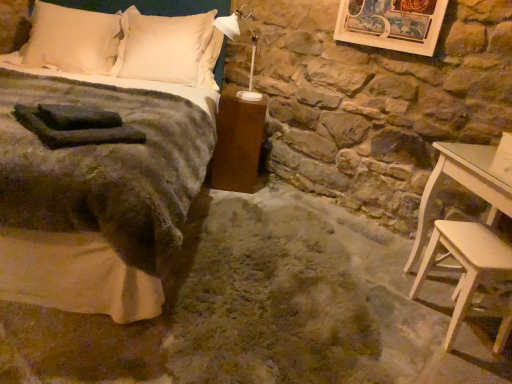
The image size is (512, 384). I want to click on light beige wood stool at lower right, so click(x=466, y=264).

Describe the element at coordinates (169, 48) in the screenshot. I see `satin white pillow at upper center, the first pillow from the right` at that location.

You are a GUI agent. You are given a task and a screenshot of the screen. Output one action in this format:
    pyautogui.click(x=<x>, y=<y>)
    Task: Click on the satin white pillow at upper center, the first pillow from the right
    
    Given the screenshot: What is the action you would take?
    pyautogui.click(x=169, y=48)

This screenshot has width=512, height=384. Find the location of `white soft pillow at upper left, arranged as the 2th pillow when viewed from the right`. white soft pillow at upper left, arranged as the 2th pillow when viewed from the right is located at coordinates (71, 40).

This screenshot has height=384, width=512. Find the location of `velvet green blanket at left`. velvet green blanket at left is located at coordinates (106, 158).

Locate an element on the screen. The width and height of the screenshot is (512, 384). pillow that is the 2nd object located behind the velvet green blanket at left is located at coordinates (169, 48).

From a real-world perspective, which is physically above, satin white pillow at upper center, the first pillow from the right, or velvet green blanket at left?

In real-world perspective, satin white pillow at upper center, the first pillow from the right, is above.

Which object is closer to the camera taking this photo, satin white pillow at upper center, the first pillow from the right, or velvet green blanket at left?

velvet green blanket at left is in front.

From the image's perspective, is satin white pillow at upper center, the first pillow from the right, above or below velvet green blanket at left?

Based on their image positions, satin white pillow at upper center, the first pillow from the right, is located above velvet green blanket at left.

Based on the photo, is satin white pillow at upper center, the 2th pillow in the left-to-right sequence, completely or partially inside velvet green blanket at left?

That's correct, satin white pillow at upper center, the 2th pillow in the left-to-right sequence, is inside velvet green blanket at left.

From a real-world perspective, is velvet green blanket at left located beneath satin white pillow at upper center, the first pillow from the right?

Correct, in the physical world, velvet green blanket at left is lower than satin white pillow at upper center, the first pillow from the right.

Which of these two, velvet green blanket at left or satin white pillow at upper center, the 2th pillow in the left-to-right sequence, is thinner?

satin white pillow at upper center, the 2th pillow in the left-to-right sequence.

From the picture: Is velvet green blanket at left positioned far away from satin white pillow at upper center, the first pillow from the right?

No, velvet green blanket at left is in close proximity to satin white pillow at upper center, the first pillow from the right.

Is the surface of white soft pillow at upper left, arranged as the 2th pillow when viewed from the right, in direct contact with satin white pillow at upper center, the first pillow from the right?

No, white soft pillow at upper left, arranged as the 2th pillow when viewed from the right, is not in contact with satin white pillow at upper center, the first pillow from the right.

Which is closer to the camera, (114, 24) or (189, 33)?

Point (114, 24) is positioned farther from the camera compared to point (189, 33).

Does white soft pillow at upper left, which is counted as the 1th pillow, starting from the left, have a larger size compared to satin white pillow at upper center, the 2th pillow in the left-to-right sequence?

No, white soft pillow at upper left, which is counted as the 1th pillow, starting from the left, is not bigger than satin white pillow at upper center, the 2th pillow in the left-to-right sequence.

Considering the relative positions of white soft pillow at upper left, arranged as the 2th pillow when viewed from the right, and satin white pillow at upper center, the 2th pillow in the left-to-right sequence, in the image provided, is white soft pillow at upper left, arranged as the 2th pillow when viewed from the right, to the left of satin white pillow at upper center, the 2th pillow in the left-to-right sequence, from the viewer's perspective?

Yes.

Which is correct: satin white pillow at upper center, the 2th pillow in the left-to-right sequence, is inside light beige wood stool at lower right, or outside of it?

satin white pillow at upper center, the 2th pillow in the left-to-right sequence, is spatially situated outside light beige wood stool at lower right.

Which of these two, satin white pillow at upper center, the 2th pillow in the left-to-right sequence, or light beige wood stool at lower right, stands taller?

satin white pillow at upper center, the 2th pillow in the left-to-right sequence.

Is satin white pillow at upper center, the 2th pillow in the left-to-right sequence, directly adjacent to light beige wood stool at lower right?

No.

Consider the image. Is satin white pillow at upper center, the first pillow from the right, in front of or behind light beige wood stool at lower right in the image?

Visually, satin white pillow at upper center, the first pillow from the right, is located behind light beige wood stool at lower right.

Between point (476, 247) and point (210, 93), which one is positioned in front?

The point (476, 247) is closer to the camera.

How different are the orientations of light beige wood stool at lower right and velvet green blanket at left in degrees?

77.7 degrees separate the facing orientations of light beige wood stool at lower right and velvet green blanket at left.

Identify the location of stool beneath the velvet green blanket at left (from a real-world perspective). This screenshot has height=384, width=512. (466, 264).

Considering the sizes of objects light beige wood stool at lower right and velvet green blanket at left in the image provided, who is wider, light beige wood stool at lower right or velvet green blanket at left?

Wider between the two is velvet green blanket at left.

Is light beige wood stool at lower right next to satin white pillow at upper center, the 2th pillow in the left-to-right sequence, and touching it?

light beige wood stool at lower right is not next to satin white pillow at upper center, the 2th pillow in the left-to-right sequence, and they're not touching.

Where is `stool located below the satin white pillow at upper center, the first pillow from the right (from the image's perspective)`? The height and width of the screenshot is (384, 512). stool located below the satin white pillow at upper center, the first pillow from the right (from the image's perspective) is located at coordinates tap(466, 264).

How many degrees apart are the facing directions of light beige wood stool at lower right and satin white pillow at upper center, the first pillow from the right?

80.2 degrees.

Based on their sizes in the image, would you say brown matte nightstand at lower center is bigger or smaller than velvet green blanket at left?

In the image, brown matte nightstand at lower center appears to be smaller than velvet green blanket at left.

From the image's perspective, would you say brown matte nightstand at lower center is positioned over velvet green blanket at left?

No, from the image's perspective, brown matte nightstand at lower center is not over velvet green blanket at left.

Does point (242, 122) come closer to viewer compared to point (193, 196)?

No, (242, 122) is behind (193, 196).

Considering the relative sizes of brown matte nightstand at lower center and velvet green blanket at left in the image provided, is brown matte nightstand at lower center thinner than velvet green blanket at left?

Correct, the width of brown matte nightstand at lower center is less than that of velvet green blanket at left.

Locate an element on the screen. The height and width of the screenshot is (384, 512). pillow on the right of velvet green blanket at left is located at coordinates (169, 48).

Find the location of a particular element. The height and width of the screenshot is (384, 512). bed directly beneath the satin white pillow at upper center, the 2th pillow in the left-to-right sequence (from a real-world perspective) is located at coordinates (106, 158).

When comparing their distances from light beige wood stool at lower right, does satin white pillow at upper center, the 2th pillow in the left-to-right sequence, or white soft pillow at upper left, arranged as the 2th pillow when viewed from the right, seem closer?

Based on the image, satin white pillow at upper center, the 2th pillow in the left-to-right sequence, appears to be nearer to light beige wood stool at lower right.

When comparing their distances from satin white pillow at upper center, the first pillow from the right, does brown matte nightstand at lower center or white soft pillow at upper left, which is counted as the 1th pillow, starting from the left, seem further?

Among the two, brown matte nightstand at lower center is located further to satin white pillow at upper center, the first pillow from the right.

Based on their spatial positions, is velvet green blanket at left or light beige wood stool at lower right closer to satin white pillow at upper center, the first pillow from the right?

velvet green blanket at left.

From the image, which object appears to be nearer to light beige wood stool at lower right, brown matte nightstand at lower center or white soft pillow at upper left, which is counted as the 1th pillow, starting from the left?

brown matte nightstand at lower center is closer to light beige wood stool at lower right.

Based on the photo, from the image, which object appears to be nearer to satin white pillow at upper center, the 2th pillow in the left-to-right sequence, velvet green blanket at left or brown matte nightstand at lower center?

velvet green blanket at left.

Estimate the real-world distances between objects in this image. Which object is closer to brown matte nightstand at lower center, light beige wood stool at lower right or white soft pillow at upper left, arranged as the 2th pillow when viewed from the right?

white soft pillow at upper left, arranged as the 2th pillow when viewed from the right, is closer to brown matte nightstand at lower center.

Based on their spatial positions, is velvet green blanket at left or brown matte nightstand at lower center closer to light beige wood stool at lower right?

brown matte nightstand at lower center is closer to light beige wood stool at lower right.

Considering their positions, is velvet green blanket at left positioned further to satin white pillow at upper center, the 2th pillow in the left-to-right sequence, than white soft pillow at upper left, arranged as the 2th pillow when viewed from the right?

The object further to satin white pillow at upper center, the 2th pillow in the left-to-right sequence, is white soft pillow at upper left, arranged as the 2th pillow when viewed from the right.

Find the location of a particular element. The height and width of the screenshot is (384, 512). nightstand situated between velvet green blanket at left and light beige wood stool at lower right from left to right is located at coordinates (237, 144).

I want to click on nightstand between velvet green blanket at left and white soft pillow at upper left, which is counted as the 1th pillow, starting from the left, from front to back, so click(237, 144).

The image size is (512, 384). I want to click on nightstand between satin white pillow at upper center, the 2th pillow in the left-to-right sequence, and light beige wood stool at lower right, so click(x=237, y=144).

You are a GUI agent. You are given a task and a screenshot of the screen. Output one action in this format:
    pyautogui.click(x=<x>, y=<y>)
    Task: Click on the pillow between white soft pillow at upper left, which is counted as the 1th pillow, starting from the left, and light beige wood stool at lower right
    
    Given the screenshot: What is the action you would take?
    pyautogui.click(x=169, y=48)